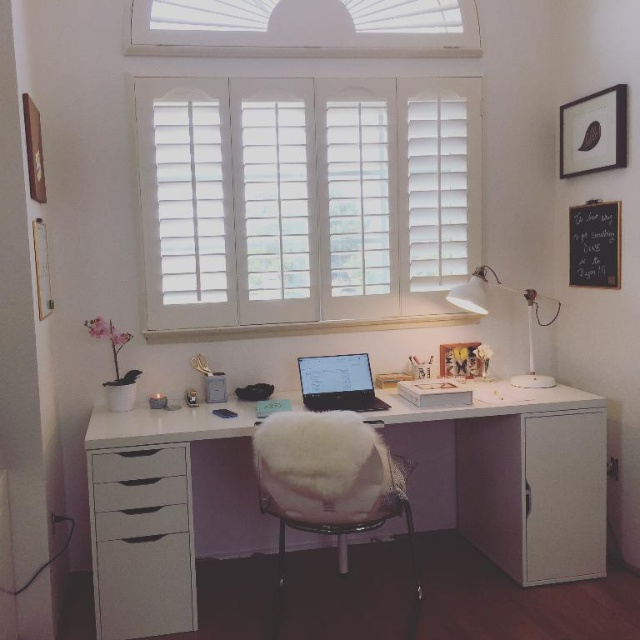
Question: Is white matte drawer at left further to the viewer compared to white plastic desk lamp at upper right?

Choices:
 (A) yes
 (B) no

Answer: (B)

Question: Which point appears farthest from the camera in this image?

Choices:
 (A) (362, 458)
 (B) (509, 566)
 (C) (380, 257)
 (D) (244, 29)

Answer: (C)

Question: Does white glossy computer desk at center have a greater width compared to white wood window at upper center?

Choices:
 (A) no
 (B) yes

Answer: (A)

Question: Is white matte file cabinet at right bigger than white fluffy cushion at center?

Choices:
 (A) yes
 (B) no

Answer: (A)

Question: Considering the real-world distances, which object is farthest from the white fluffy cushion at center?

Choices:
 (A) white wooden shutters at upper center
 (B) white matte file cabinet at right
 (C) white wood window at upper center
 (D) white glossy computer desk at center

Answer: (C)

Question: Estimate the real-world distances between objects in this image. Which object is closer to the white fluffy cushion at center?

Choices:
 (A) white wooden shutters at upper center
 (B) white matte file cabinet at right
 (C) white plastic desk lamp at upper right

Answer: (B)